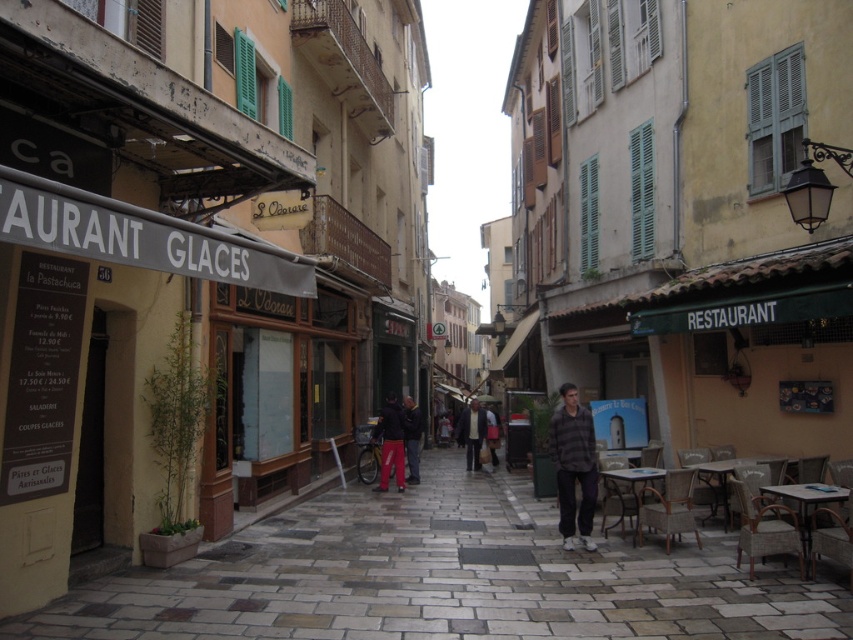
You are a delivery person who needs to cross the street from the ice cream shop on the left to the post office on the right. The delivery cart you are using is 1.8 meters wide. Can you safely navigate the 5.54 meters between the stone paving at center and the post office on the right?

The distance between the stone paving at center and the post office on the right is 5.54 meters. Since the delivery cart is 1.8 meters wide, there is sufficient space to safely navigate the 5.54 meters between the stone paving at center and the post office on the right.

You are standing at the entrance of the ice cream shop on the left side of the street. You want to hand a flyer to a person wearing the dark blue jacket at center and the dark gray sweater at center. Which one is closer to you?

The dark blue jacket at center is 5.68 meters away from the dark gray sweater at center. Since you are at the entrance, the person wearing the dark gray sweater at center is closer to you than the dark blue jacket at center.